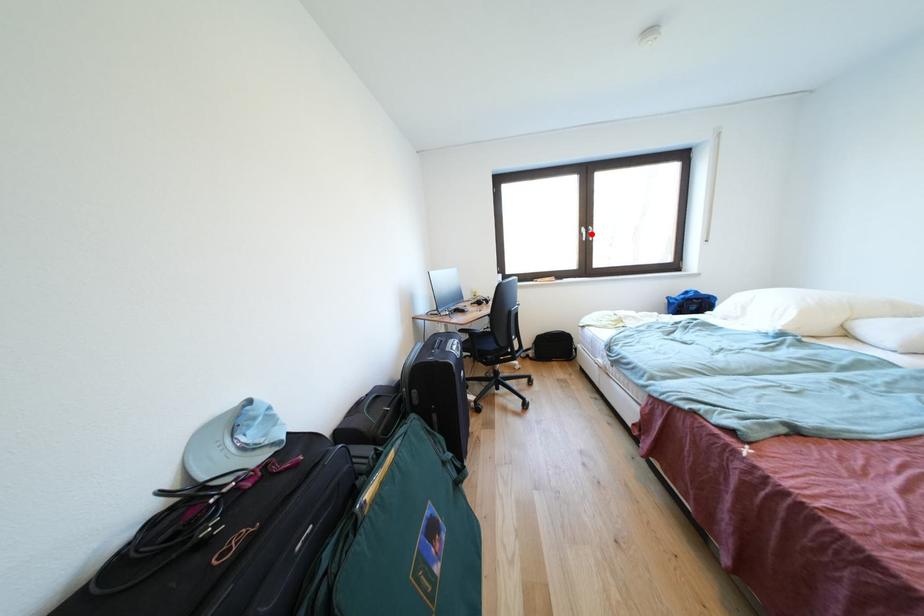
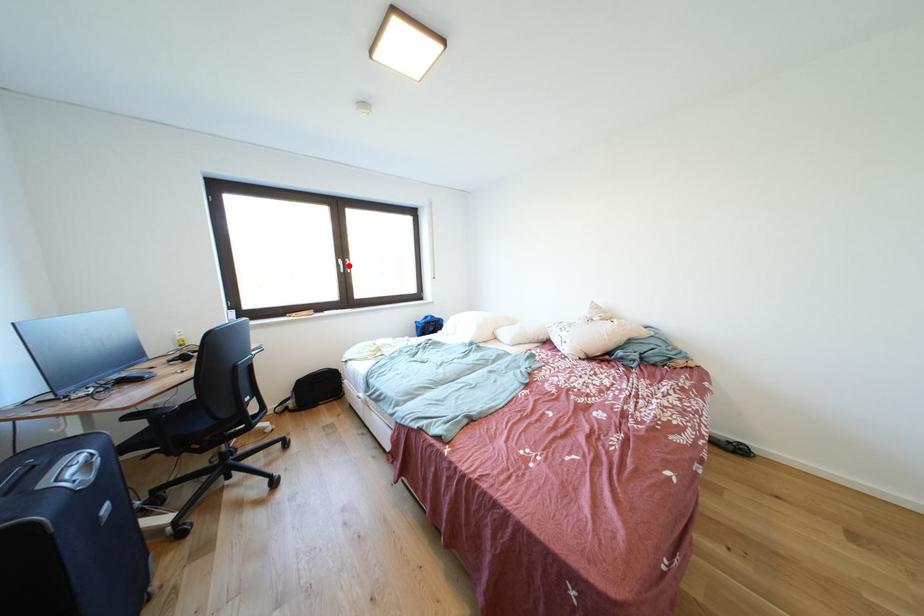
I am providing you with two images of the same scene from different viewpoints. A red point is marked on the first image and another point is marked on the second image. Is the red point in image1 aligned with the point shown in image2?

Yes